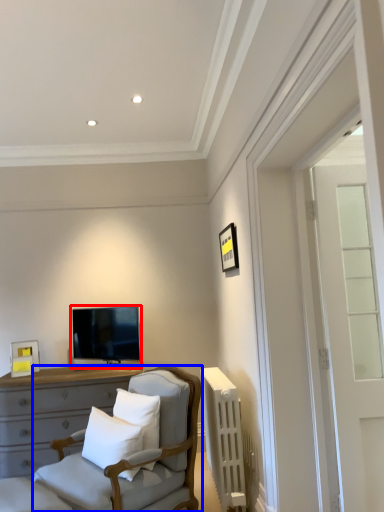
Question: Which of the following is the farthest to the observer, television (highlighted by a red box) or chair (highlighted by a blue box)?

Choices:
 (A) television
 (B) chair

Answer: (A)